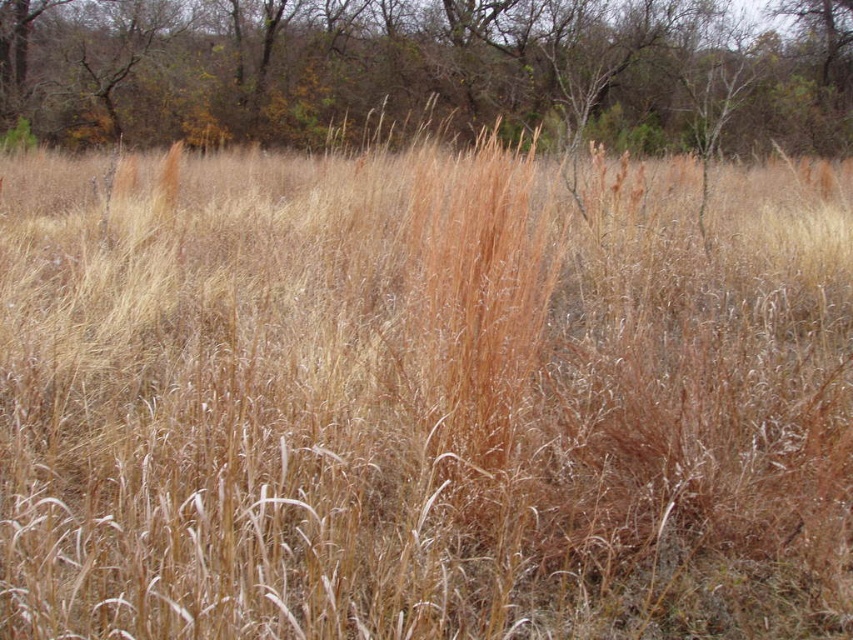
Does point (695, 29) come farther from viewer compared to point (473, 227)?

Yes, it is behind point (473, 227).

Looking at this image, is brown textured grass at upper center thinner than brown grass at center?

In fact, brown textured grass at upper center might be wider than brown grass at center.

Is point (561, 138) in front of point (419, 243)?

That is False.

The width and height of the screenshot is (853, 640). I want to click on brown textured grass at upper center, so click(428, 72).